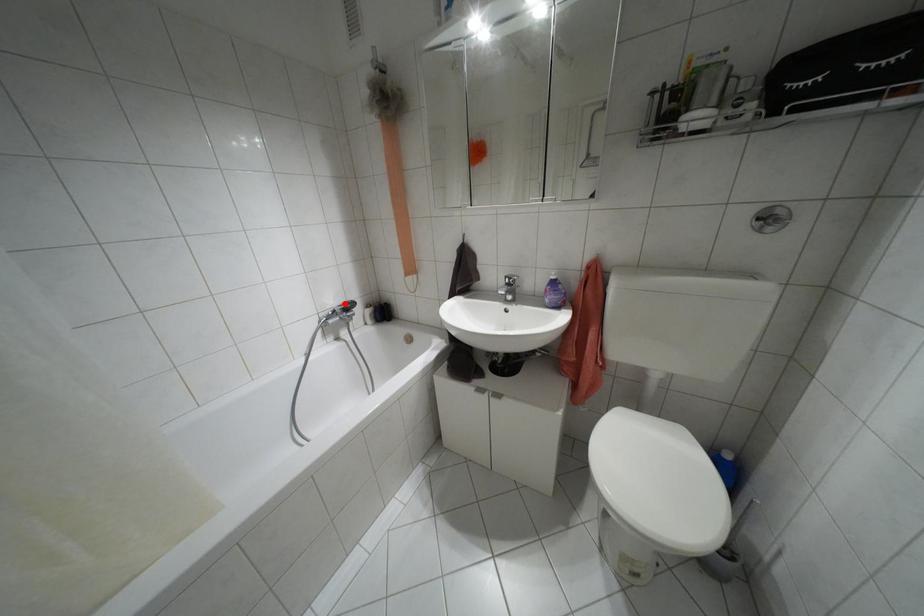
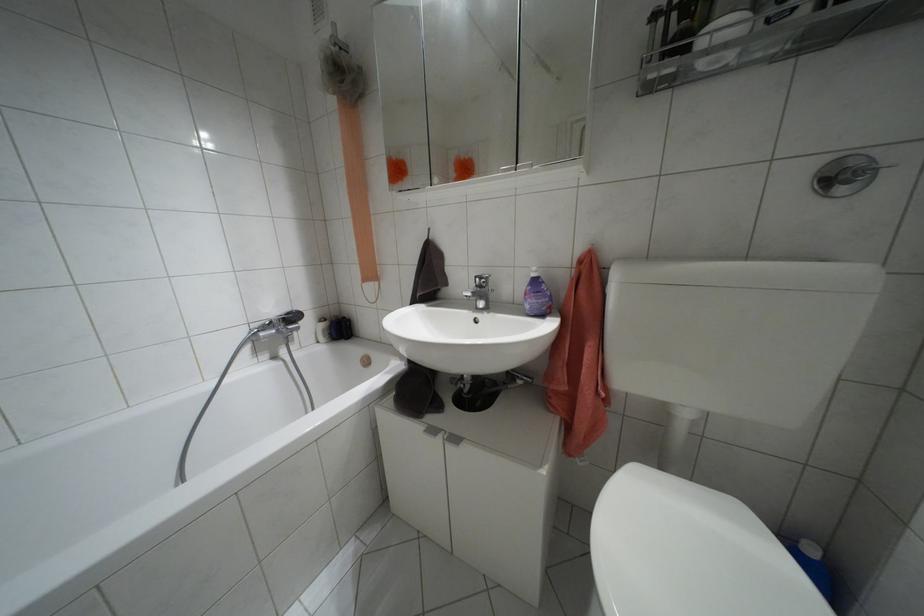
The point at the highlighted location is marked in the first image. Where is the corresponding point in the second image?

(286, 313)